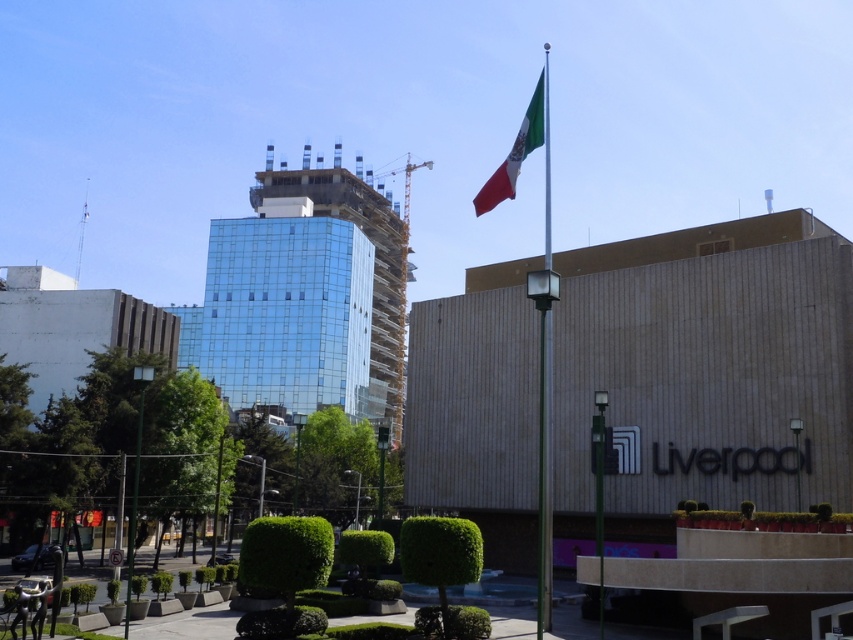
Question: Is silver metallic flag pole at center above green and white fabric flag at upper right?

Choices:
 (A) no
 (B) yes

Answer: (A)

Question: Which of the following is the closest to the observer?

Choices:
 (A) silver metallic flag pole at center
 (B) green and white fabric flag at upper right
 (C) transparent glass building at center

Answer: (A)

Question: Which object appears closest to the camera in this image?

Choices:
 (A) green and white fabric flag at upper right
 (B) silver metallic flag pole at center

Answer: (B)

Question: Can you confirm if transparent glass building at center is wider than green and white fabric flag at upper right?

Choices:
 (A) yes
 (B) no

Answer: (A)

Question: Is transparent glass building at center smaller than green and white fabric flag at upper right?

Choices:
 (A) yes
 (B) no

Answer: (A)

Question: Which point appears farthest from the camera in this image?

Choices:
 (A) (503, 173)
 (B) (546, 486)

Answer: (A)